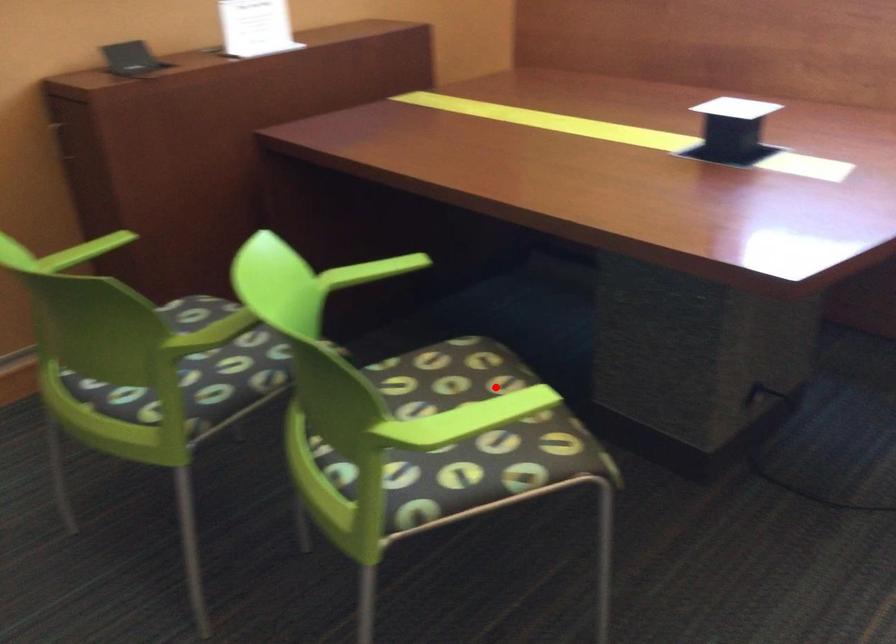
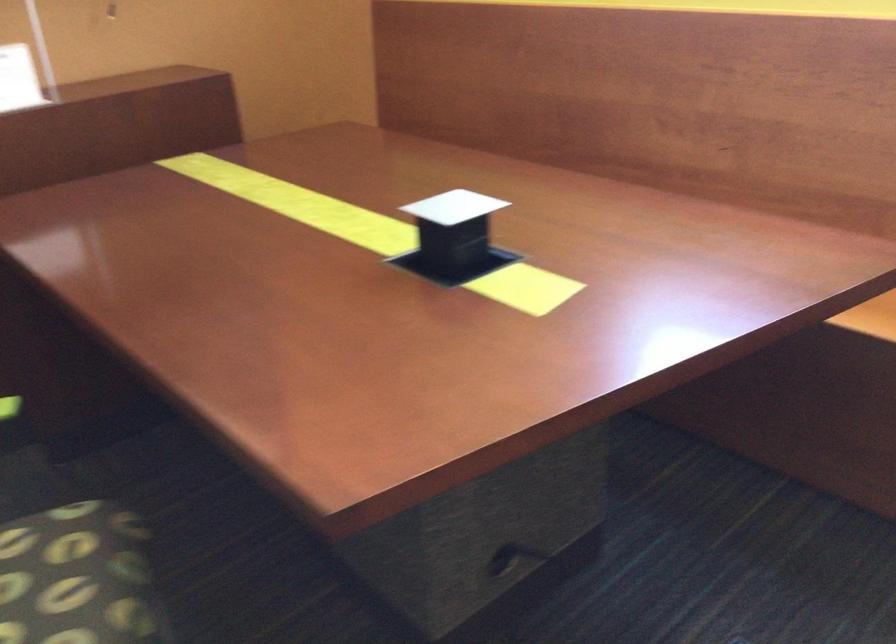
Question: I am providing you with two images of the same scene from different viewpoints. Given a red point in image1, look at the same physical point in image2. Is it:

Choices:
 (A) Closer to the viewpoint
 (B) Farther from the viewpoint

Answer: (A)